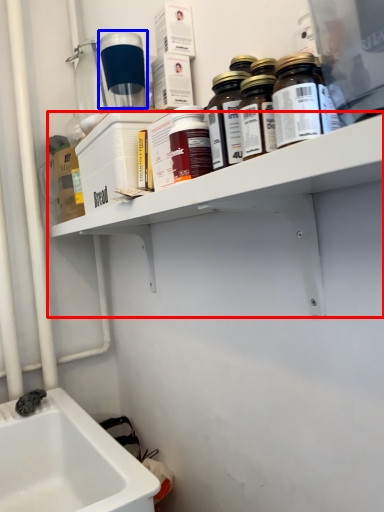
Question: Which point is closer to the camera, shelf (highlighted by a red box) or bottle (highlighted by a blue box)?

Choices:
 (A) shelf
 (B) bottle

Answer: (A)